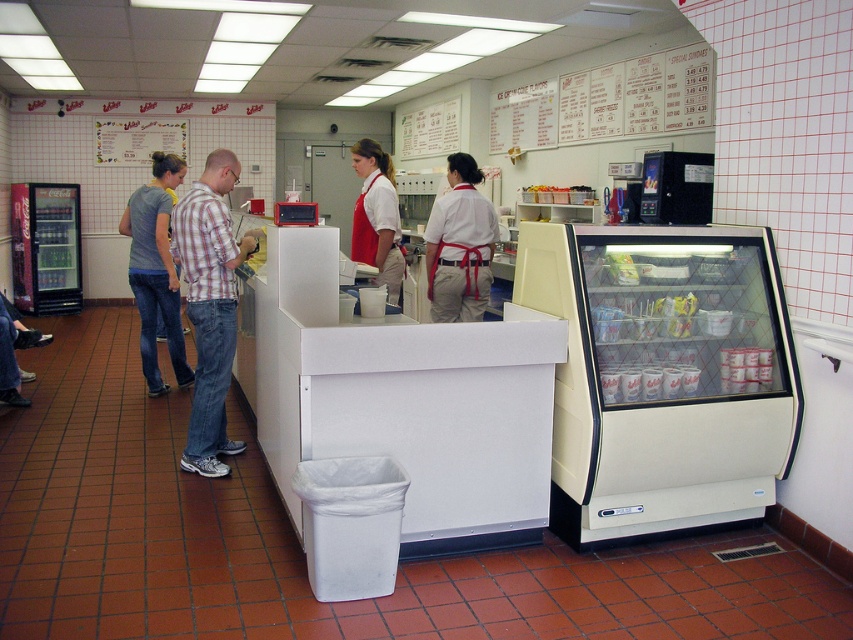
Based on the photo, you are a customer in the shop and want to ask a question to the employee wearing the plaid shirt at center. Which direction should you walk towards relative to the gray cotton shirt at left?

The plaid shirt at center is positioned on the right side of the gray cotton shirt at left, so you should walk towards the right side of the gray cotton shirt at left to reach the plaid shirt at center.

You are a customer trying to order from the counter. Which employee should you address, the one wearing the plaid shirt at center or the white cotton apron at center?

You should address the plaid shirt at center because it is in front of the white cotton apron at center, indicating they are facing the customer.